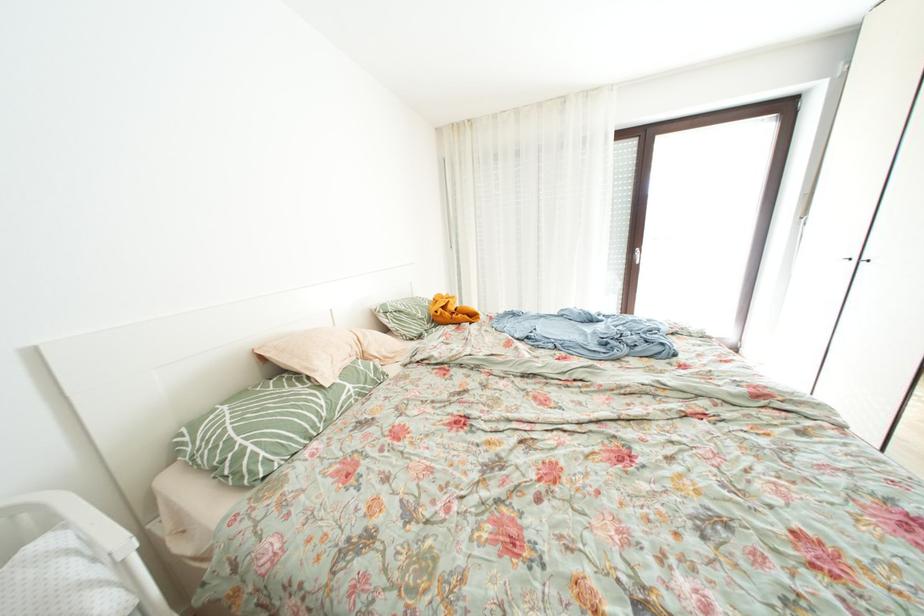
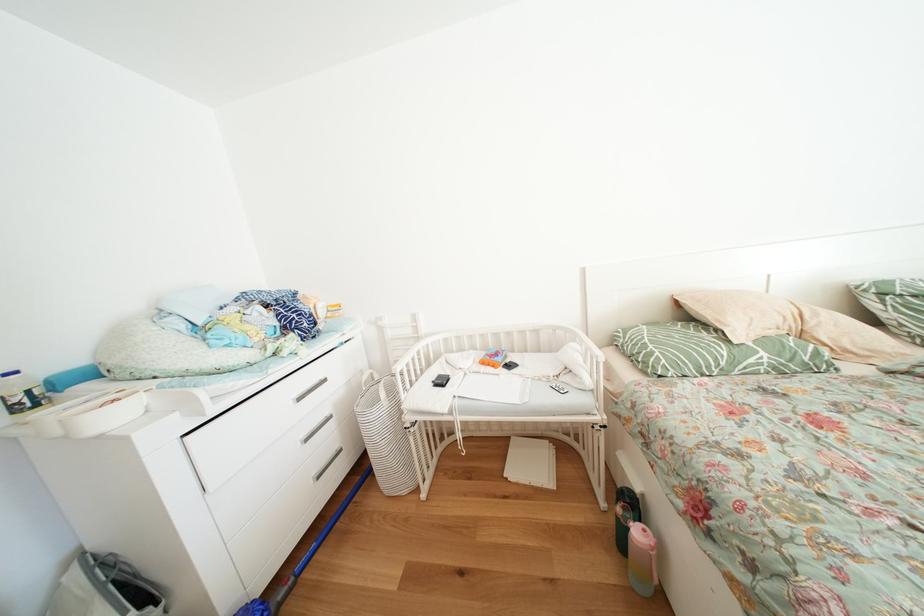
Question: The first image is from the beginning of the video and the second image is from the end. How did the camera likely rotate when shooting the video?

Choices:
 (A) Left
 (B) Right
 (C) Up
 (D) Down

Answer: (A)